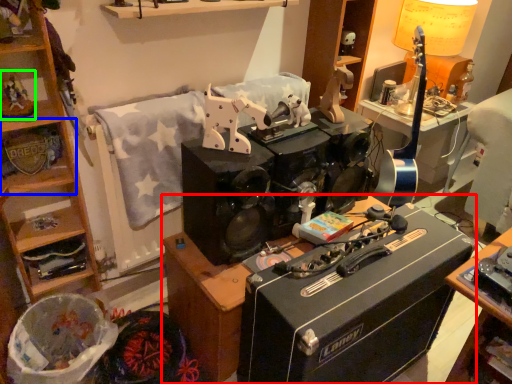
Question: Based on their relative distances, which object is nearer to desk (highlighted by a red box)? Choose from shelf (highlighted by a blue box) and toy (highlighted by a green box).

Choices:
 (A) shelf
 (B) toy

Answer: (A)